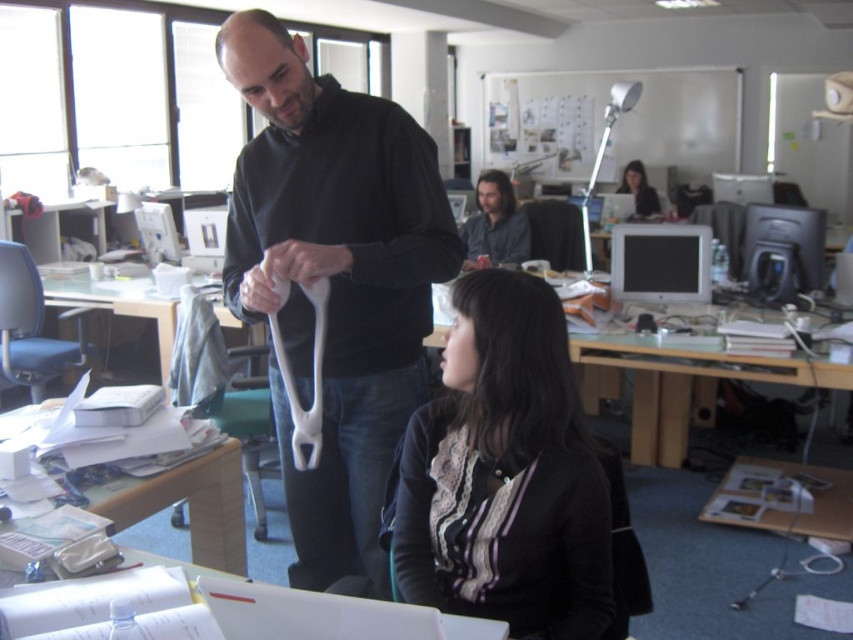
Does point (282, 292) come behind point (625, 193)?

No, it is not.

Can you confirm if white matte wii remote at center is positioned to the left of matte black hair at upper center?

Indeed, white matte wii remote at center is positioned on the left side of matte black hair at upper center.

This screenshot has width=853, height=640. I want to click on white matte wii remote at center, so click(312, 378).

Measure the distance between black matte sweater at center and white matte wii remote at center.

black matte sweater at center and white matte wii remote at center are 12.69 centimeters apart.

Is black matte sweater at center bigger than white matte wii remote at center?

Yes.

Is point (412, 364) farther from viewer compared to point (320, 368)?

Yes.

Locate an element on the screen. The image size is (853, 640). black matte sweater at center is located at coordinates [x=334, y=280].

What do you see at coordinates (506, 476) in the screenshot? This screenshot has width=853, height=640. I see `matte black sweater at center` at bounding box center [506, 476].

What do you see at coordinates (506, 476) in the screenshot? I see `matte black sweater at center` at bounding box center [506, 476].

You are a GUI agent. You are given a task and a screenshot of the screen. Output one action in this format:
    pyautogui.click(x=<x>, y=<y>)
    Task: Click on the matte black sweater at center
    The width and height of the screenshot is (853, 640).
    Given the screenshot: What is the action you would take?
    pyautogui.click(x=506, y=476)